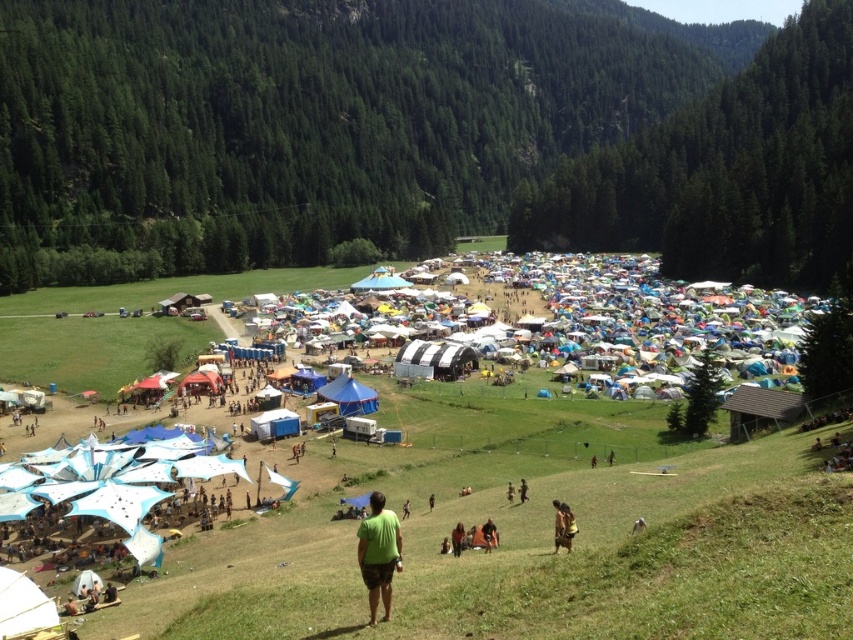
Can you confirm if green matte shirt at lower center is thinner than blue fabric tent at center?

Yes, green matte shirt at lower center is thinner than blue fabric tent at center.

At what (x,y) coordinates should I click in order to perform the action: click on green matte shirt at lower center. Please return your answer as a coordinate pair (x, y). Looking at the image, I should click on (378, 554).